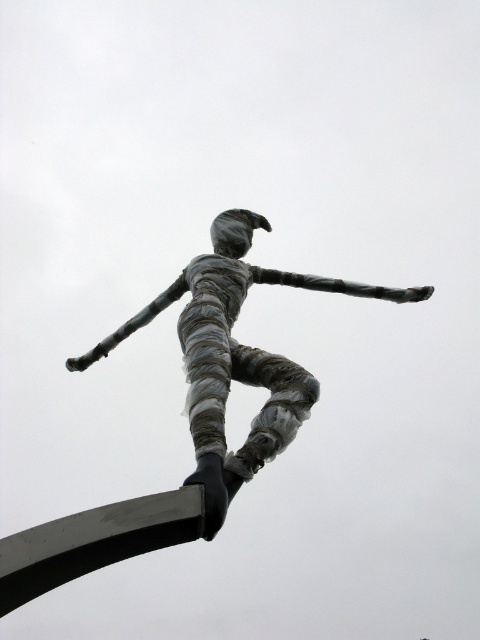
Between shiny silver figure at center and black metal pole at lower left, which one appears on the right side from the viewer's perspective?

Positioned to the right is shiny silver figure at center.

Is shiny silver figure at center shorter than black metal pole at lower left?

Incorrect, shiny silver figure at center's height does not fall short of black metal pole at lower left's.

Describe the element at coordinates (235, 355) in the screenshot. I see `shiny silver figure at center` at that location.

Where is `shiny silver figure at center`? shiny silver figure at center is located at coordinates (235, 355).